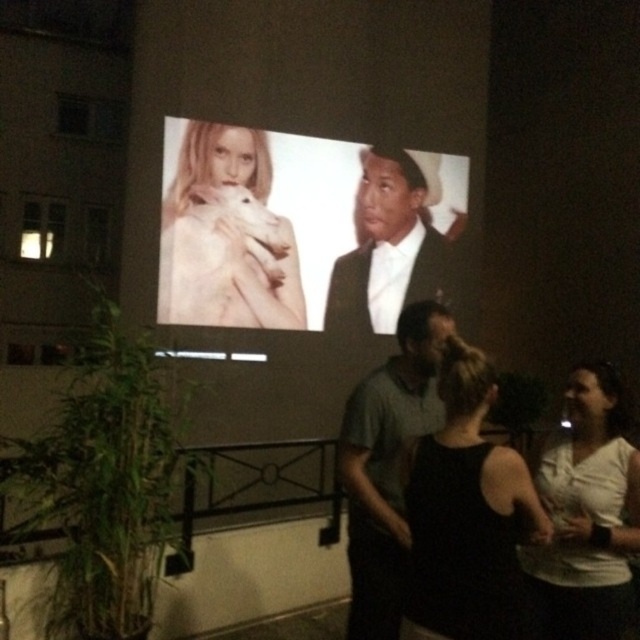
Is white glossy poster at center positioned behind black fabric dress at center?

Yes, it is behind black fabric dress at center.

Describe the element at coordinates (298, 225) in the screenshot. This screenshot has width=640, height=640. I see `white glossy poster at center` at that location.

Who is more forward, (262, 163) or (419, 554)?

Positioned in front is point (419, 554).

The width and height of the screenshot is (640, 640). I want to click on white glossy poster at center, so click(298, 225).

Can you confirm if smooth beige scarf at upper left is positioned above gray cotton shirt at center?

Yes, smooth beige scarf at upper left is above gray cotton shirt at center.

Is smooth beige scarf at upper left to the right of gray cotton shirt at center from the viewer's perspective?

In fact, smooth beige scarf at upper left is to the left of gray cotton shirt at center.

The height and width of the screenshot is (640, 640). Find the location of `smooth beige scarf at upper left`. smooth beige scarf at upper left is located at coordinates (227, 236).

Image resolution: width=640 pixels, height=640 pixels. What are the coordinates of `smooth beige scarf at upper left` in the screenshot? It's located at (227, 236).

Does white glossy poster at center have a greater height compared to white matte shirt at center?

Yes.

Does white glossy poster at center come behind white matte shirt at center?

That is True.

Is point (396, 273) farther from viewer compared to point (570, 502)?

Yes, point (396, 273) is behind point (570, 502).

Identify the location of white glossy poster at center. The height and width of the screenshot is (640, 640). (298, 225).